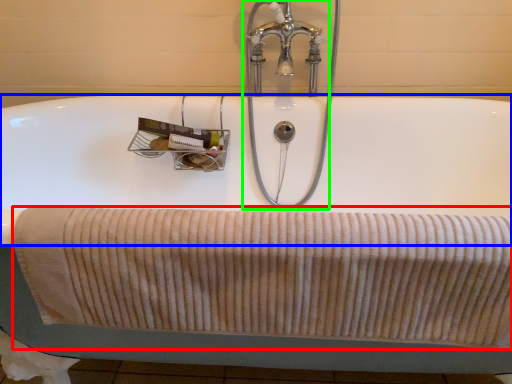
Question: Which object is positioned farthest from bath towel (highlighted by a red box)? Select from bath (highlighted by a blue box) and tap (highlighted by a green box).

Choices:
 (A) bath
 (B) tap

Answer: (B)